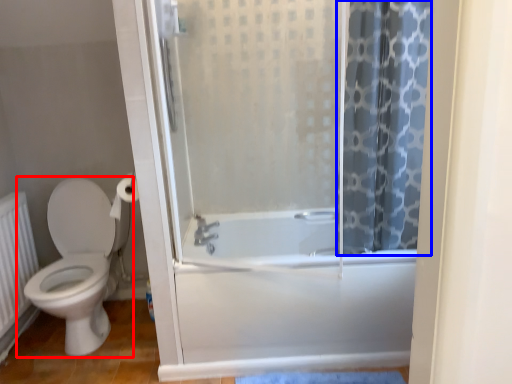
Question: Which point is closer to the camera, toilet (highlighted by a red box) or shower curtain (highlighted by a blue box)?

Choices:
 (A) toilet
 (B) shower curtain

Answer: (B)